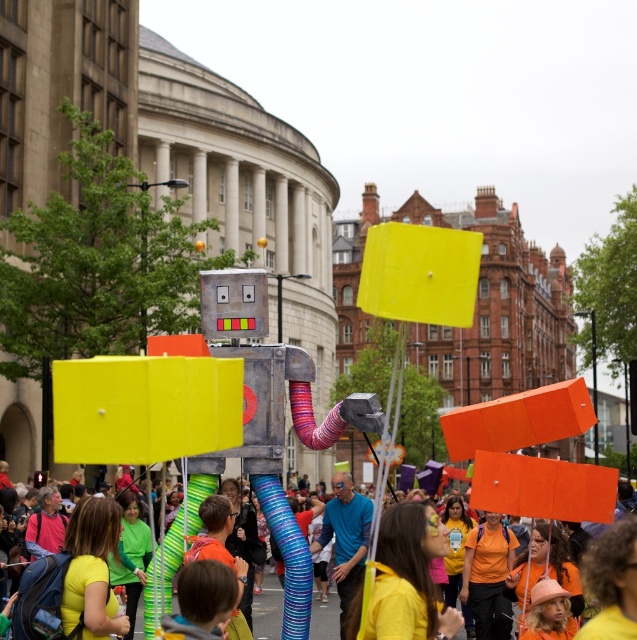
Question: Among these points, which one is nearest to the camera?

Choices:
 (A) (341, 602)
 (B) (401, 570)

Answer: (B)

Question: Which point appears closest to the camera in this image?

Choices:
 (A) (419, 508)
 (B) (331, 504)

Answer: (A)

Question: Considering the real-world distances, which object is farthest from the orange cardboard sign at center?

Choices:
 (A) yellow fabric headband at center
 (B) blue fabric at center

Answer: (A)

Question: Is the position of blue fabric at center less distant than that of orange cardboard sign at center?

Choices:
 (A) yes
 (B) no

Answer: (B)

Question: Observing the image, what is the correct spatial positioning of blue fabric at center in reference to orange cardboard sign at center?

Choices:
 (A) below
 (B) above

Answer: (B)

Question: Does yellow fabric headband at center come in front of blue fabric at center?

Choices:
 (A) yes
 (B) no

Answer: (A)